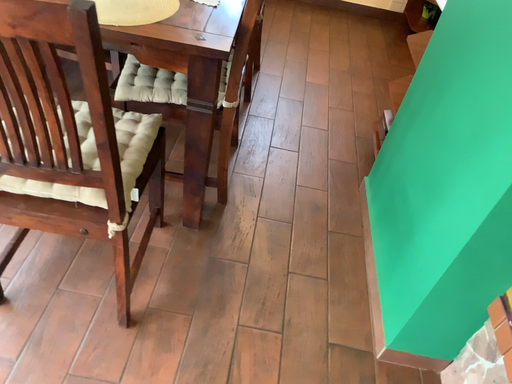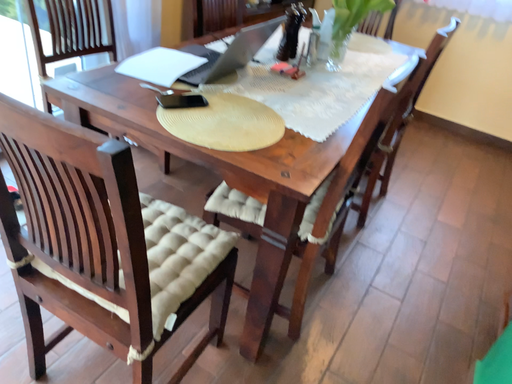
Question: Which way did the camera rotate in the video?

Choices:
 (A) rotated downward
 (B) rotated upward

Answer: (B)